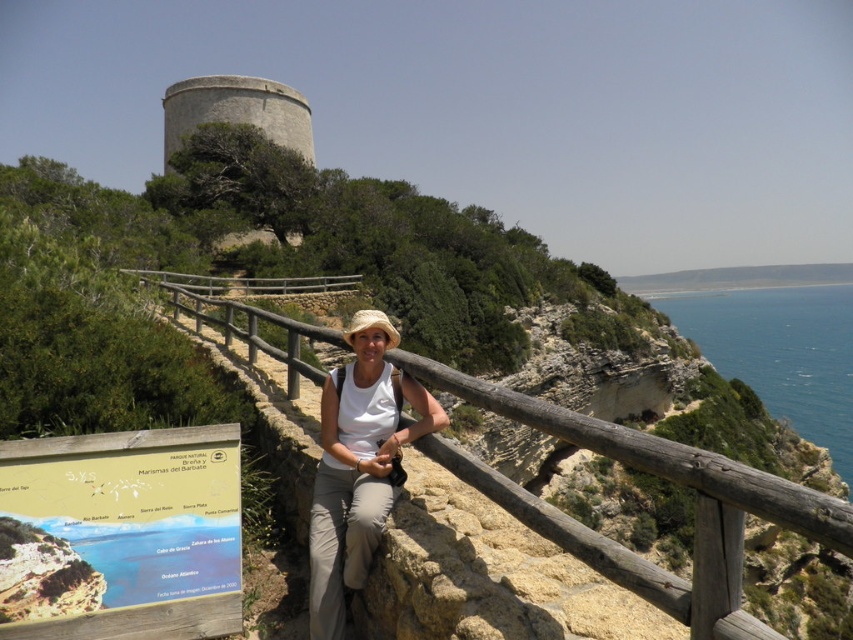
You are a photographer trying to capture a photo of the wooden at center and the white matte shirt at center. Which object should you zoom in more on to ensure both are visible in the frame?

The wooden at center is wider than the white matte shirt at center, so you should zoom in more on the white matte shirt at center to ensure both are visible in the frame.